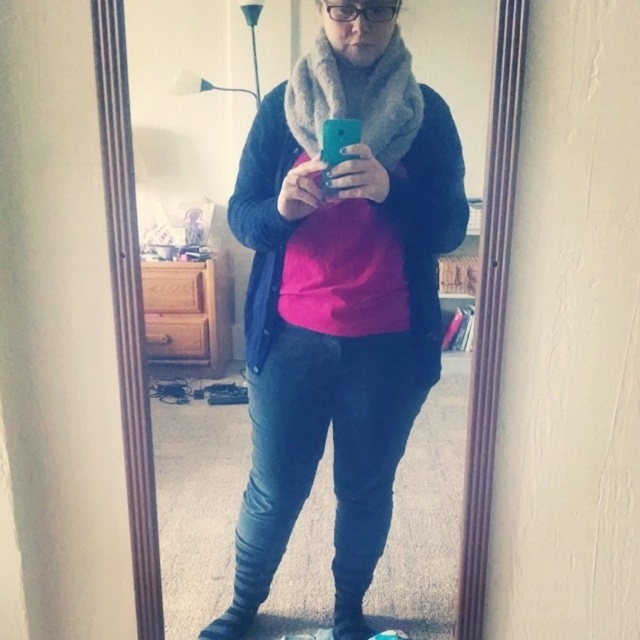
Can you confirm if fuzzy gray scarf at upper center is shorter than gray woolen scarf at center?

In fact, fuzzy gray scarf at upper center may be taller than gray woolen scarf at center.

Does point (132, 339) come in front of point (371, 134)?

Yes.

Is point (136, 413) behind point (320, 28)?

No, (136, 413) is in front of (320, 28).

You are a GUI agent. You are given a task and a screenshot of the screen. Output one action in this format:
    pyautogui.click(x=<x>, y=<y>)
    Task: Click on the fuzzy gray scarf at upper center
    This screenshot has width=640, height=640.
    Given the screenshot: What is the action you would take?
    pyautogui.click(x=128, y=308)